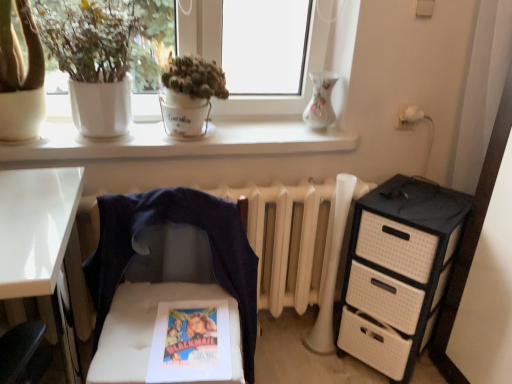
Question: From a real-world perspective, is black textured chest of drawers at right positioned above or below white matte window sill at upper center?

Choices:
 (A) below
 (B) above

Answer: (A)

Question: Is black textured chest of drawers at right in front of or behind white matte window sill at upper center in the image?

Choices:
 (A) behind
 (B) front

Answer: (B)

Question: Which of these objects is positioned closest to the porcelain vase at upper center?

Choices:
 (A) black textured chest of drawers at right
 (B) matte paper comic book at center
 (C) white matte window sill at upper center
 (D) green matte pot at upper center, the second houseplant from the left
 (E) white matte pot at upper left, the first houseplant when ordered from left to right

Answer: (C)

Question: Which object is positioned farthest from the green matte pot at upper center, which is the 1th houseplant from right to left?

Choices:
 (A) white matte pot at upper left, the first houseplant when ordered from left to right
 (B) white matte window sill at upper center
 (C) matte paper comic book at center
 (D) black textured chest of drawers at right
 (E) porcelain vase at upper center

Answer: (D)